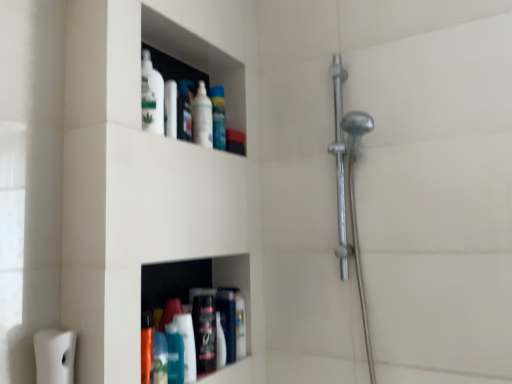
Question: From the image's perspective, is polished chrome shower at right on white matte toilet paper at lower left?

Choices:
 (A) yes
 (B) no

Answer: (A)

Question: Are polished chrome shower at right and white matte toilet paper at lower left located far from each other?

Choices:
 (A) yes
 (B) no

Answer: (B)

Question: From a real-world perspective, is polished chrome shower at right positioned under white matte toilet paper at lower left based on gravity?

Choices:
 (A) yes
 (B) no

Answer: (B)

Question: Is polished chrome shower at right thinner than white matte toilet paper at lower left?

Choices:
 (A) no
 (B) yes

Answer: (B)

Question: Can you confirm if polished chrome shower at right is shorter than white matte toilet paper at lower left?

Choices:
 (A) yes
 (B) no

Answer: (B)

Question: From their relative heights in the image, would you say white matte toilet paper at lower left is taller or shorter than polished chrome shower at right?

Choices:
 (A) tall
 (B) short

Answer: (B)

Question: From the image's perspective, is white matte toilet paper at lower left positioned above or below polished chrome shower at right?

Choices:
 (A) below
 (B) above

Answer: (A)

Question: Would you say white matte toilet paper at lower left is inside or outside polished chrome shower at right?

Choices:
 (A) inside
 (B) outside

Answer: (B)

Question: Visually, is white matte toilet paper at lower left positioned to the left or to the right of polished chrome shower at right?

Choices:
 (A) right
 (B) left

Answer: (B)

Question: Looking at their shapes, would you say matte black bottle at lower center, the second toiletry in the top-to-bottom sequence, is wider or thinner than matte plastic container at upper center, the second toiletry viewed from the right?

Choices:
 (A) wide
 (B) thin

Answer: (A)

Question: Considering the positions of matte black bottle at lower center, marked as the 2th toiletry in a left-to-right arrangement, and matte plastic container at upper center, the second toiletry viewed from the right, in the image, is matte black bottle at lower center, marked as the 2th toiletry in a left-to-right arrangement, bigger or smaller than matte plastic container at upper center, the second toiletry viewed from the right,?

Choices:
 (A) small
 (B) big

Answer: (B)

Question: Is matte black bottle at lower center, marked as the 2th toiletry in a left-to-right arrangement, situated inside matte plastic container at upper center, which appears as the 1th toiletry when viewed from the top, or outside?

Choices:
 (A) inside
 (B) outside

Answer: (B)

Question: Based on their positions, is matte black bottle at lower center, which is the 1th toiletry in right-to-left order, located to the left or right of matte plastic container at upper center, the second toiletry viewed from the right?

Choices:
 (A) left
 (B) right

Answer: (B)

Question: From the image's perspective, is polished chrome shower at right above or below translucent plastic spray bottle at upper center, which is the 2th cleaning product from front to back?

Choices:
 (A) above
 (B) below

Answer: (B)

Question: Is polished chrome shower at right situated inside translucent plastic spray bottle at upper center, marked as the first cleaning product in a top-to-bottom arrangement, or outside?

Choices:
 (A) outside
 (B) inside

Answer: (A)